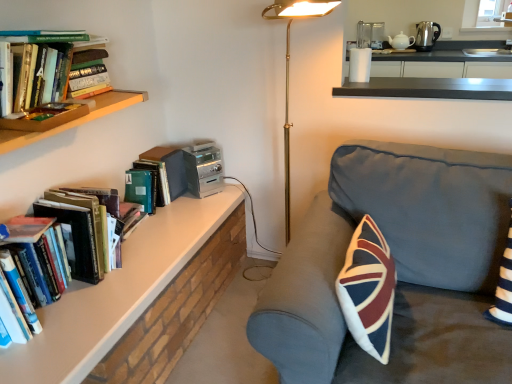
This screenshot has width=512, height=384. I want to click on hardcover books at left, marked as the first book in a front-to-back arrangement, so click(113, 206).

In order to face white glossy counter at upper right, should I rotate leftwards or rightwards?

Rotate your view right by about 21.393°.

Describe the element at coordinates (439, 73) in the screenshot. I see `white glossy counter at upper right` at that location.

The image size is (512, 384). What do you see at coordinates (426, 35) in the screenshot? I see `polished stainless steel kettle at upper right, the third appliance positioned from the bottom` at bounding box center [426, 35].

Image resolution: width=512 pixels, height=384 pixels. What are the coordinates of `hardcover books at left, which is counted as the 2th book, starting from the back` in the screenshot? It's located at (38, 67).

Considering the relative positions of polished stainless steel kettle at upper right, which is the 2th appliance in back-to-front order, and white glossy counter at upper right in the image provided, is polished stainless steel kettle at upper right, which is the 2th appliance in back-to-front order, in front of white glossy counter at upper right?

No, it is not.

Can you confirm if polished stainless steel kettle at upper right, which is the 3th appliance from left to right, is positioned to the left of white glossy counter at upper right?

No.

Could you tell me if polished stainless steel kettle at upper right, placed as the first appliance when sorted from top to bottom, is turned towards white glossy counter at upper right?

Yes, polished stainless steel kettle at upper right, placed as the first appliance when sorted from top to bottom, is turned towards white glossy counter at upper right.

Can you confirm if polished stainless steel kettle at upper right, the third appliance positioned from the bottom, is thinner than white glossy counter at upper right?

Yes, polished stainless steel kettle at upper right, the third appliance positioned from the bottom, is thinner than white glossy counter at upper right.

The height and width of the screenshot is (384, 512). Identify the location of counter positioned vertically above the hardcover book at upper left, the 1th book viewed from the back (from a real-world perspective). (439, 73).

Can you confirm if white glossy counter at upper right is shorter than hardcover book at upper left, the 1th book viewed from the back?

Yes, white glossy counter at upper right is shorter than hardcover book at upper left, the 1th book viewed from the back.

From the image's perspective, is white glossy counter at upper right located above or below hardcover book at upper left, which appears as the third book when viewed from the front?

white glossy counter at upper right is situated higher than hardcover book at upper left, which appears as the third book when viewed from the front, in the image.

From a real-world perspective, relative to hardcover book at upper left, which appears as the third book when viewed from the front, is white glossy counter at upper right vertically above or below?

white glossy counter at upper right is situated higher than hardcover book at upper left, which appears as the third book when viewed from the front, in the real world.

Is polished stainless steel kettle at upper right, which is the 1th appliance in right-to-left order, completely or partially inside hardcover books at left, the third book from the back?

No, polished stainless steel kettle at upper right, which is the 1th appliance in right-to-left order, is not a part of hardcover books at left, the third book from the back.

Identify the location of appliance that is the 3rd object to the right of the hardcover books at left, marked as the first book in a front-to-back arrangement, starting at the anchor. Image resolution: width=512 pixels, height=384 pixels. (426, 35).

From the picture: Is hardcover books at left, marked as the first book in a front-to-back arrangement, aimed at polished stainless steel kettle at upper right, which is the 1th appliance in right-to-left order?

No, hardcover books at left, marked as the first book in a front-to-back arrangement, is not turned towards polished stainless steel kettle at upper right, which is the 1th appliance in right-to-left order.

Can we say white ceramic teapot at upper right, the second appliance in the bottom-to-top sequence, lies outside white glossy counter at upper right?

Indeed, white ceramic teapot at upper right, the second appliance in the bottom-to-top sequence, is completely outside white glossy counter at upper right.

How many degrees apart are the facing directions of white ceramic teapot at upper right, arranged as the 2th appliance when viewed from the top, and white glossy counter at upper right?

The angle between the facing direction of white ceramic teapot at upper right, arranged as the 2th appliance when viewed from the top, and the facing direction of white glossy counter at upper right is 9.2 degrees.

Considering the positions of objects white ceramic teapot at upper right, arranged as the 2th appliance when viewed from the top, and white glossy counter at upper right in the image provided, who is more to the left, white ceramic teapot at upper right, arranged as the 2th appliance when viewed from the top, or white glossy counter at upper right?

white glossy counter at upper right.

Does hardcover books at left, marked as the first book in a front-to-back arrangement, appear on the left side of dark gray fabric couch at center?

Indeed, hardcover books at left, marked as the first book in a front-to-back arrangement, is positioned on the left side of dark gray fabric couch at center.

Is hardcover books at left, the third book from the back, next to dark gray fabric couch at center and touching it?

hardcover books at left, the third book from the back, and dark gray fabric couch at center are clearly separated.

Is hardcover books at left, the third book from the back, positioned with its back to dark gray fabric couch at center?

hardcover books at left, the third book from the back, is not turned away from dark gray fabric couch at center.

What's the angular difference between hardcover books at left, marked as the first book in a front-to-back arrangement, and dark gray fabric couch at center's facing directions?

The angle between the facing direction of hardcover books at left, marked as the first book in a front-to-back arrangement, and the facing direction of dark gray fabric couch at center is 90.4 degrees.

Between gold metallic floor lamp at center and silver metallic stereo at upper center, the third appliance viewed from the top, which one appears on the right side from the viewer's perspective?

From the viewer's perspective, gold metallic floor lamp at center appears more on the right side.

In the scene shown: Can you confirm if gold metallic floor lamp at center is bigger than silver metallic stereo at upper center, the third appliance viewed from the top?

Yes, gold metallic floor lamp at center is bigger than silver metallic stereo at upper center, the third appliance viewed from the top.

From a real-world perspective, does gold metallic floor lamp at center stand above silver metallic stereo at upper center, the third appliance viewed from the top?

Correct, in the physical world, gold metallic floor lamp at center is higher than silver metallic stereo at upper center, the third appliance viewed from the top.

Is gold metallic floor lamp at center facing away from silver metallic stereo at upper center, the third appliance viewed from the top?

That's not correct — gold metallic floor lamp at center is not looking away from silver metallic stereo at upper center, the third appliance viewed from the top.

Which is in front, white ceramic teapot at upper right, arranged as the 2th appliance when viewed from the top, or hardcover books at left, which appears as the 2th book when viewed from the front?

hardcover books at left, which appears as the 2th book when viewed from the front.

Considering the points (413, 39) and (70, 33), which point is behind, point (413, 39) or point (70, 33)?

The point (413, 39) is farther from the camera.

Is white ceramic teapot at upper right, the second appliance in the bottom-to-top sequence, wider or thinner than hardcover books at left, which appears as the 2th book when viewed from the front?

Considering their sizes, white ceramic teapot at upper right, the second appliance in the bottom-to-top sequence, looks slimmer than hardcover books at left, which appears as the 2th book when viewed from the front.

Find the location of a particular element. counter on the left of polished stainless steel kettle at upper right, the third appliance positioned from the bottom is located at coordinates (439, 73).

At what (x,y) coordinates should I click in order to perform the action: click on the 2nd book directly beneath the white glossy counter at upper right (from a real-world perspective). Please return your answer as a coordinate pair (x, y). The image size is (512, 384). Looking at the image, I should click on (165, 172).

Looking at the image, which one is located closer to polished stainless steel kettle at upper right, which is the 2th appliance in back-to-front order, gold metallic floor lamp at center or hardcover books at left, which is counted as the 2th book, starting from the back?

Based on the image, gold metallic floor lamp at center appears to be nearer to polished stainless steel kettle at upper right, which is the 2th appliance in back-to-front order.

Which object lies further to the anchor point hardcover books at left, which appears as the 2th book when viewed from the front, hardcover books at left, the third book from the back, or gold metallic floor lamp at center?

gold metallic floor lamp at center lies further to hardcover books at left, which appears as the 2th book when viewed from the front, than the other object.

From the image, which object appears to be nearer to hardcover books at left, which is counted as the 2th book, starting from the back, gold metallic floor lamp at center or silver metallic stereo at upper center, acting as the 1th appliance starting from the front?

silver metallic stereo at upper center, acting as the 1th appliance starting from the front.

Based on their spatial positions, is silver metallic stereo at upper center, acting as the 1th appliance starting from the front, or white ceramic teapot at upper right, placed as the 2th appliance when sorted from left to right, further from gold metallic floor lamp at center?

Based on the image, white ceramic teapot at upper right, placed as the 2th appliance when sorted from left to right, appears to be further to gold metallic floor lamp at center.

Which object lies further to the anchor point hardcover books at left, which is counted as the 2th book, starting from the back, white ceramic teapot at upper right, placed as the 2th appliance when sorted from left to right, or hardcover book at upper left, the 1th book viewed from the back?

Based on the image, white ceramic teapot at upper right, placed as the 2th appliance when sorted from left to right, appears to be further to hardcover books at left, which is counted as the 2th book, starting from the back.

When comparing their distances from polished stainless steel kettle at upper right, which ranks as the 2th appliance in front-to-back order, does white glossy counter at upper right or white ceramic teapot at upper right, which ranks as the 1th appliance in back-to-front order, seem further?

The object further to polished stainless steel kettle at upper right, which ranks as the 2th appliance in front-to-back order, is white glossy counter at upper right.

When comparing their distances from hardcover book at upper left, the 1th book viewed from the back, does silver metallic stereo at upper center, the third appliance viewed from the top, or hardcover books at left, the third book from the back, seem closer?

silver metallic stereo at upper center, the third appliance viewed from the top, is positioned closer to the anchor hardcover book at upper left, the 1th book viewed from the back.

Which object lies nearer to the anchor point hardcover books at left, which appears as the 2th book when viewed from the front, polished stainless steel kettle at upper right, which is the 1th appliance in right-to-left order, or hardcover book at upper left, the 1th book viewed from the back?

Based on the image, hardcover book at upper left, the 1th book viewed from the back, appears to be nearer to hardcover books at left, which appears as the 2th book when viewed from the front.

Image resolution: width=512 pixels, height=384 pixels. I want to click on table lamp between dark gray fabric couch at center and white glossy counter at upper right from front to back, so click(x=289, y=68).

The height and width of the screenshot is (384, 512). Find the location of `book between white glossy counter at upper right and polished stainless steel kettle at upper right, placed as the first appliance when sorted from top to bottom, in the front-back direction`. book between white glossy counter at upper right and polished stainless steel kettle at upper right, placed as the first appliance when sorted from top to bottom, in the front-back direction is located at coordinates (165, 172).

Find the location of `table lamp between dark gray fabric couch at center and white ceramic teapot at upper right, marked as the 3th appliance in a front-to-back arrangement, in the front-back direction`. table lamp between dark gray fabric couch at center and white ceramic teapot at upper right, marked as the 3th appliance in a front-to-back arrangement, in the front-back direction is located at coordinates (289, 68).

Where is `book between hardcover books at left, the third book from the back, and hardcover book at upper left, which appears as the third book when viewed from the front, from front to back`? book between hardcover books at left, the third book from the back, and hardcover book at upper left, which appears as the third book when viewed from the front, from front to back is located at coordinates (38, 67).